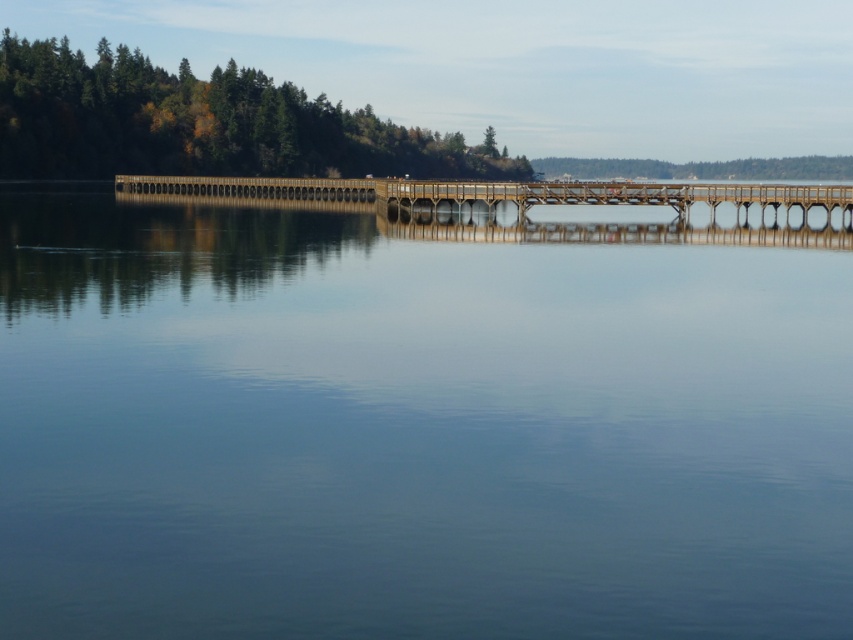
Measure the distance between point (x=595, y=545) and camera.

Point (x=595, y=545) and camera are 10.52 meters apart.

Is point (646, 372) farther from viewer compared to point (173, 93)?

No, it is not.

Between point (271, 468) and point (322, 104), which one is positioned in front?

Point (271, 468) is more forward.

At what (x,y) coordinates should I click in order to perform the action: click on transparent glass water at center. Please return your answer as a coordinate pair (x, y). The width and height of the screenshot is (853, 640). Looking at the image, I should click on point(415,426).

Which is more to the right, transparent glass water at center or brown wooden bridge at center?

transparent glass water at center is more to the right.

Is transparent glass water at center taller than brown wooden bridge at center?

In fact, transparent glass water at center may be shorter than brown wooden bridge at center.

At what (x,y) coordinates should I click in order to perform the action: click on transparent glass water at center. Please return your answer as a coordinate pair (x, y). This screenshot has height=640, width=853. Looking at the image, I should click on (415, 426).

Does green matte trees at upper left have a greater width compared to brown wooden bridge at center?

Correct, the width of green matte trees at upper left exceeds that of brown wooden bridge at center.

Consider the image. How distant is green matte trees at upper left from brown wooden bridge at center?

A distance of 182.98 feet exists between green matte trees at upper left and brown wooden bridge at center.

Is point (144, 100) closer to viewer compared to point (643, 200)?

No.

You are a GUI agent. You are given a task and a screenshot of the screen. Output one action in this format:
    pyautogui.click(x=<x>, y=<y>)
    Task: Click on the green matte trees at upper left
    The image size is (853, 640).
    Given the screenshot: What is the action you would take?
    pyautogui.click(x=202, y=124)